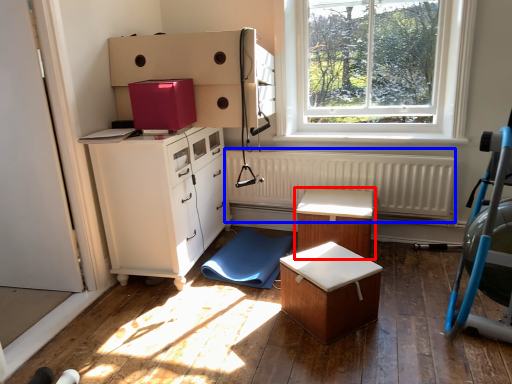
Question: Which object is further to the camera taking this photo, table (highlighted by a red box) or radiator (highlighted by a blue box)?

Choices:
 (A) table
 (B) radiator

Answer: (B)